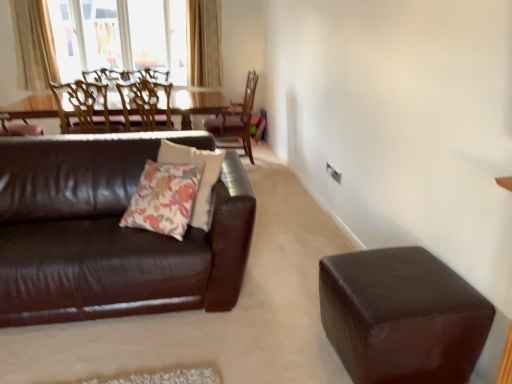
Question: From the image's perspective, is light beige textured curtain at upper center, the 1th curtain when ordered from right to left, located above shiny brown leather couch at left?

Choices:
 (A) no
 (B) yes

Answer: (B)

Question: Is light beige textured curtain at upper center, arranged as the second curtain when viewed from the left, at the left side of shiny brown leather couch at left?

Choices:
 (A) yes
 (B) no

Answer: (B)

Question: Considering the relative positions of light beige textured curtain at upper center, the 1th curtain when ordered from right to left, and shiny brown leather couch at left in the image provided, is light beige textured curtain at upper center, the 1th curtain when ordered from right to left, behind shiny brown leather couch at left?

Choices:
 (A) no
 (B) yes

Answer: (B)

Question: Can we say light beige textured curtain at upper center, arranged as the second curtain when viewed from the left, lies outside shiny brown leather couch at left?

Choices:
 (A) no
 (B) yes

Answer: (B)

Question: Is light beige textured curtain at upper center, the 1th curtain when ordered from right to left, shorter than shiny brown leather couch at left?

Choices:
 (A) no
 (B) yes

Answer: (A)

Question: Considering the positions of shiny brown leather couch at left and shiny brown leather stool at lower right in the image, is shiny brown leather couch at left wider or thinner than shiny brown leather stool at lower right?

Choices:
 (A) wide
 (B) thin

Answer: (A)

Question: In terms of height, does shiny brown leather couch at left look taller or shorter compared to shiny brown leather stool at lower right?

Choices:
 (A) short
 (B) tall

Answer: (B)

Question: Which is correct: shiny brown leather couch at left is inside shiny brown leather stool at lower right, or outside of it?

Choices:
 (A) inside
 (B) outside

Answer: (B)

Question: Relative to shiny brown leather stool at lower right, is shiny brown leather couch at left in front or behind?

Choices:
 (A) behind
 (B) front

Answer: (A)

Question: From the image's perspective, is light beige textured curtain at upper center, the 1th curtain when ordered from right to left, above or below floral-patterned fabric pillow at center?

Choices:
 (A) below
 (B) above

Answer: (B)

Question: In the image, is light beige textured curtain at upper center, arranged as the second curtain when viewed from the left, positioned in front of or behind floral-patterned fabric pillow at center?

Choices:
 (A) front
 (B) behind

Answer: (B)

Question: Is light beige textured curtain at upper center, arranged as the second curtain when viewed from the left, bigger or smaller than floral-patterned fabric pillow at center?

Choices:
 (A) big
 (B) small

Answer: (A)

Question: In terms of height, does light beige textured curtain at upper center, the 1th curtain when ordered from right to left, look taller or shorter compared to floral-patterned fabric pillow at center?

Choices:
 (A) tall
 (B) short

Answer: (A)

Question: In the image, is beige fabric curtain at upper left, marked as the second curtain in a right-to-left arrangement, positioned in front of or behind shiny brown leather couch at left?

Choices:
 (A) behind
 (B) front

Answer: (A)

Question: From their relative heights in the image, would you say beige fabric curtain at upper left, marked as the second curtain in a right-to-left arrangement, is taller or shorter than shiny brown leather couch at left?

Choices:
 (A) tall
 (B) short

Answer: (A)